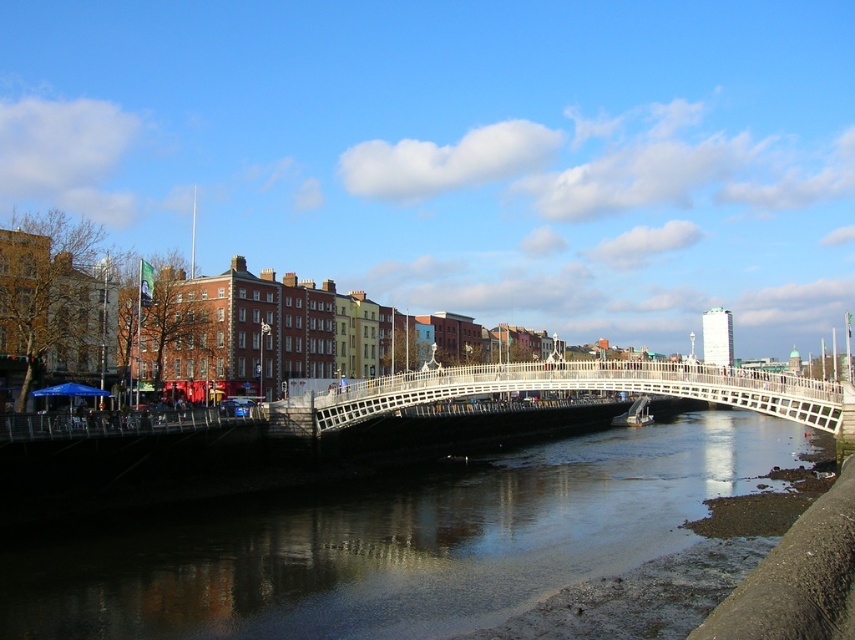
In the scene shown: You are standing on the bridge and looking down at the water. There is a point marked at coordinates point (x=394, y=541). What is located at that point?

The point (x=394, y=541) corresponds to dark reflective water at center.

You are a photographer standing on the white wooden bridge at center. You want to take a photo of the dark reflective water at center. Considering their heights, will the water be fully visible in your photo without any obstruction from the bridge?

The dark reflective water at center has a lesser height compared to white wooden bridge at center, so the water will be fully visible in your photo without any obstruction from the bridge.